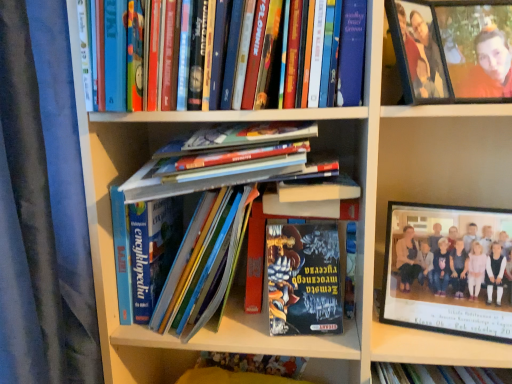
Question: Can you confirm if black plastic frame at upper right is wider than shiny metallic book at center, which is the first book in bottom-to-top order?

Choices:
 (A) no
 (B) yes

Answer: (A)

Question: Considering the relative positions of black plastic frame at upper right and shiny metallic book at center, which is the first book in bottom-to-top order, in the image provided, is black plastic frame at upper right to the left of shiny metallic book at center, which is the first book in bottom-to-top order, from the viewer's perspective?

Choices:
 (A) yes
 (B) no

Answer: (B)

Question: From the image's perspective, is black plastic frame at upper right above shiny metallic book at center, which is the first book in bottom-to-top order?

Choices:
 (A) yes
 (B) no

Answer: (A)

Question: Is black plastic frame at upper right touching shiny metallic book at center, which is the 5th book in top-to-bottom order?

Choices:
 (A) no
 (B) yes

Answer: (A)

Question: Does black plastic frame at upper right have a greater height compared to shiny metallic book at center, which is the first book in bottom-to-top order?

Choices:
 (A) no
 (B) yes

Answer: (B)

Question: Does black plastic frame at upper right have a lesser height compared to shiny metallic book at center, which is the first book in bottom-to-top order?

Choices:
 (A) no
 (B) yes

Answer: (A)

Question: Is hardcover book at upper center, the 5th book when ordered from bottom to top, oriented away from hardcover books at center, placed as the 2th book when sorted from bottom to top?

Choices:
 (A) no
 (B) yes

Answer: (A)

Question: Considering the relative positions of hardcover book at upper center, arranged as the 1th book when viewed from the top, and hardcover books at center, which is counted as the fourth book, starting from the top, in the image provided, is hardcover book at upper center, arranged as the 1th book when viewed from the top, behind hardcover books at center, which is counted as the fourth book, starting from the top,?

Choices:
 (A) yes
 (B) no

Answer: (B)

Question: Can you confirm if hardcover book at upper center, the 5th book when ordered from bottom to top, is thinner than hardcover books at center, placed as the 2th book when sorted from bottom to top?

Choices:
 (A) yes
 (B) no

Answer: (B)

Question: Could you tell me if hardcover book at upper center, arranged as the 1th book when viewed from the top, is turned towards hardcover books at center, placed as the 2th book when sorted from bottom to top?

Choices:
 (A) yes
 (B) no

Answer: (B)

Question: Considering the relative sizes of hardcover book at upper center, arranged as the 1th book when viewed from the top, and hardcover books at center, placed as the 2th book when sorted from bottom to top, in the image provided, is hardcover book at upper center, arranged as the 1th book when viewed from the top, wider than hardcover books at center, placed as the 2th book when sorted from bottom to top,?

Choices:
 (A) yes
 (B) no

Answer: (A)

Question: Is the position of hardcover book at upper center, arranged as the 1th book when viewed from the top, less distant than that of hardcover books at center, which is counted as the fourth book, starting from the top?

Choices:
 (A) no
 (B) yes

Answer: (B)

Question: Can you confirm if black plastic frame at upper right is thinner than matte plastic frame at upper right?

Choices:
 (A) yes
 (B) no

Answer: (B)